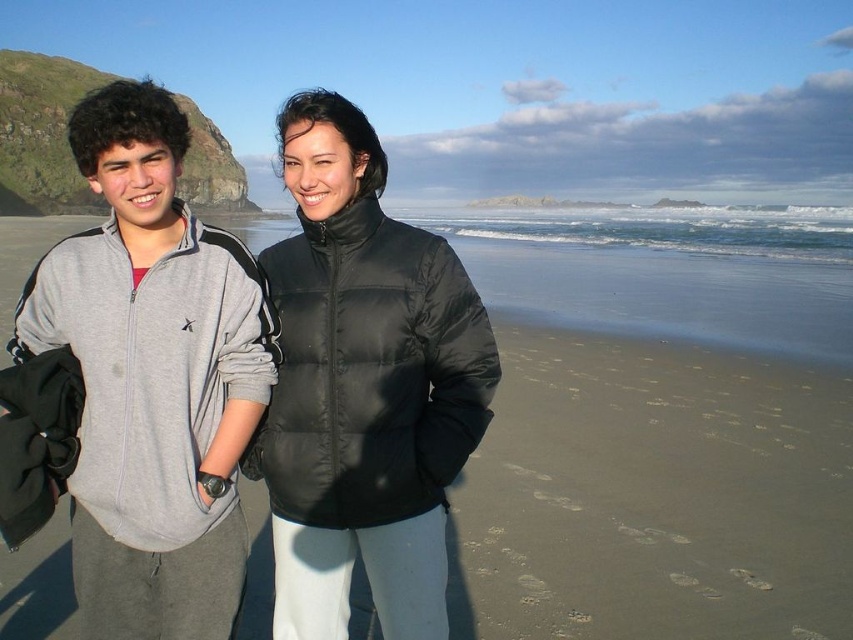
You are planning to set up a small tent for a beach picnic. Given the sandy beach at center and the gray fleece jacket at left, which object has a greater width and is more suitable for placing the tent on?

The sandy beach at center has a greater width than the gray fleece jacket at left, making it more suitable for placing the tent.

You are a photographer trying to capture a photo of the black puffer jacket at center while ensuring the sandy beach at center also appears in the frame. Which object should you focus on to ensure both are visible?

The sandy beach at center is larger in size than the black puffer jacket at center, so focusing on the sandy beach at center will ensure both objects are visible in the frame.